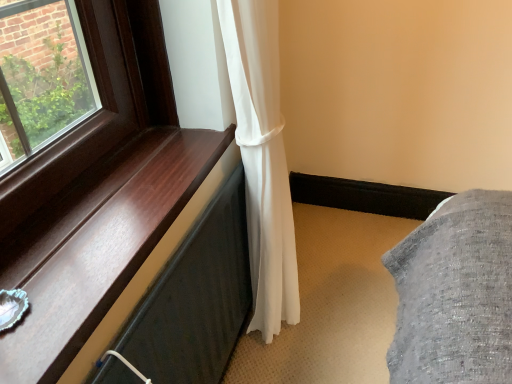
Where is `blank space above shiny wood window sill at left (from a real-world perspective)`? The height and width of the screenshot is (384, 512). blank space above shiny wood window sill at left (from a real-world perspective) is located at coordinates (112, 205).